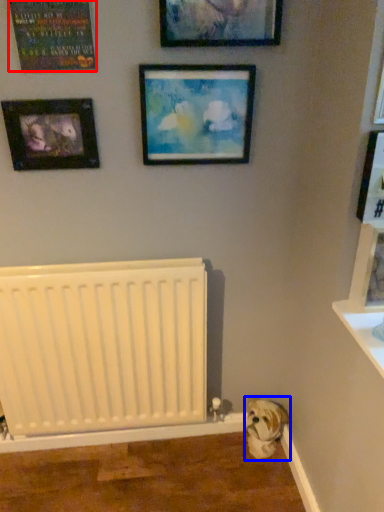
Question: Which object appears closest to the camera in this image, picture frame (highlighted by a red box) or animal (highlighted by a blue box)?

Choices:
 (A) picture frame
 (B) animal

Answer: (A)